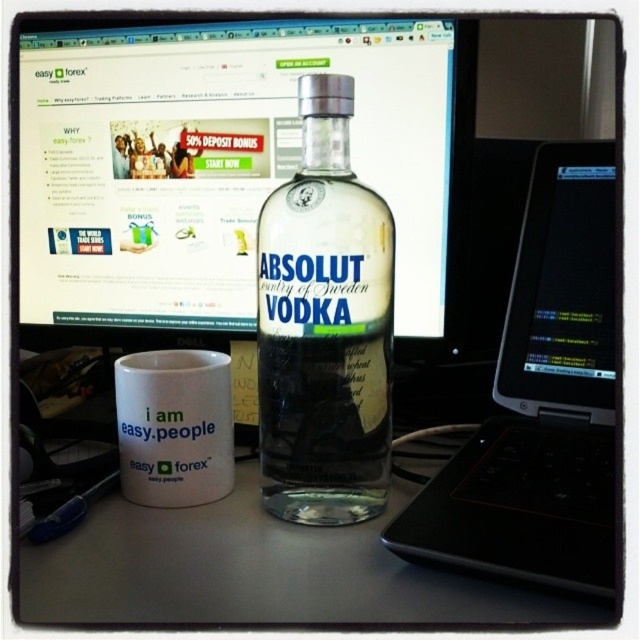
Does transparent glass monitor at center appear under white matte mug at lower left?

Incorrect, transparent glass monitor at center is not positioned below white matte mug at lower left.

Can you confirm if transparent glass monitor at center is thinner than white matte mug at lower left?

Incorrect, transparent glass monitor at center's width is not less than white matte mug at lower left's.

The width and height of the screenshot is (640, 640). What do you see at coordinates (228, 163) in the screenshot?
I see `transparent glass monitor at center` at bounding box center [228, 163].

Identify the location of transparent glass monitor at center. The width and height of the screenshot is (640, 640). click(x=228, y=163).

Is transparent glass monitor at center below clear glass bottle at center?

No.

What do you see at coordinates (228, 163) in the screenshot?
I see `transparent glass monitor at center` at bounding box center [228, 163].

This screenshot has height=640, width=640. I want to click on transparent glass monitor at center, so click(x=228, y=163).

Does clear glass bottle at center have a greater width compared to white matte mug at lower left?

Correct, the width of clear glass bottle at center exceeds that of white matte mug at lower left.

Measure the distance between clear glass bottle at center and camera.

The distance of clear glass bottle at center from camera is 16.82 inches.

Identify the location of clear glass bottle at center. (324, 326).

Where is `clear glass bottle at center`? This screenshot has width=640, height=640. clear glass bottle at center is located at coordinates (324, 326).